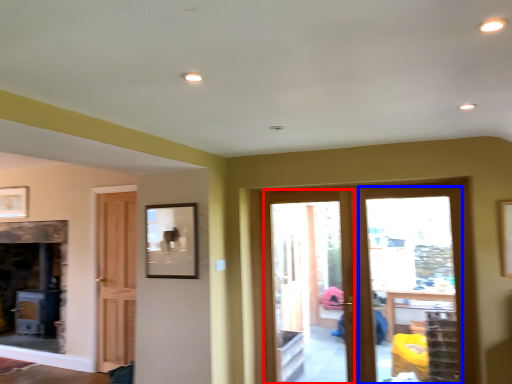
Question: Among these objects, which one is farthest to the camera, screen door (highlighted by a red box) or glass door (highlighted by a blue box)?

Choices:
 (A) screen door
 (B) glass door

Answer: (A)